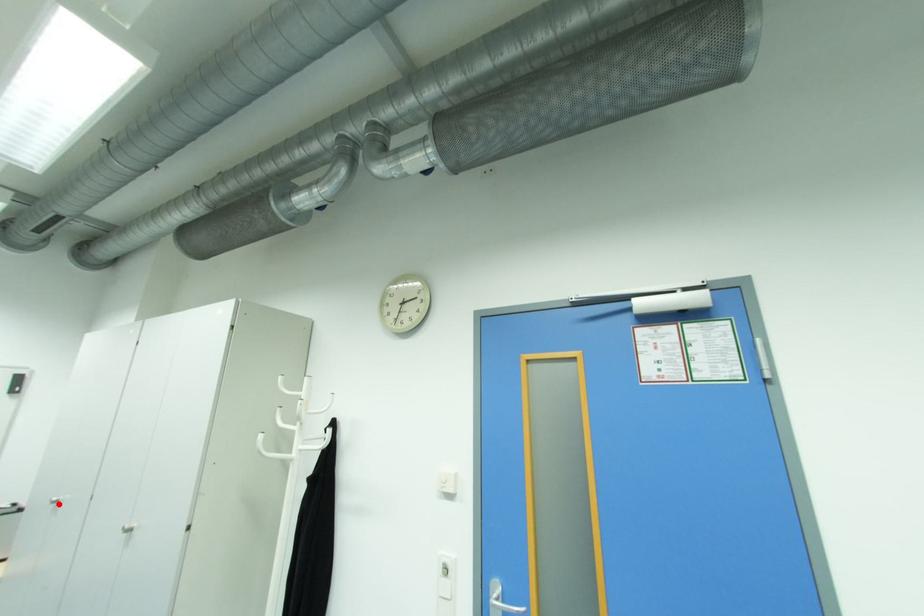
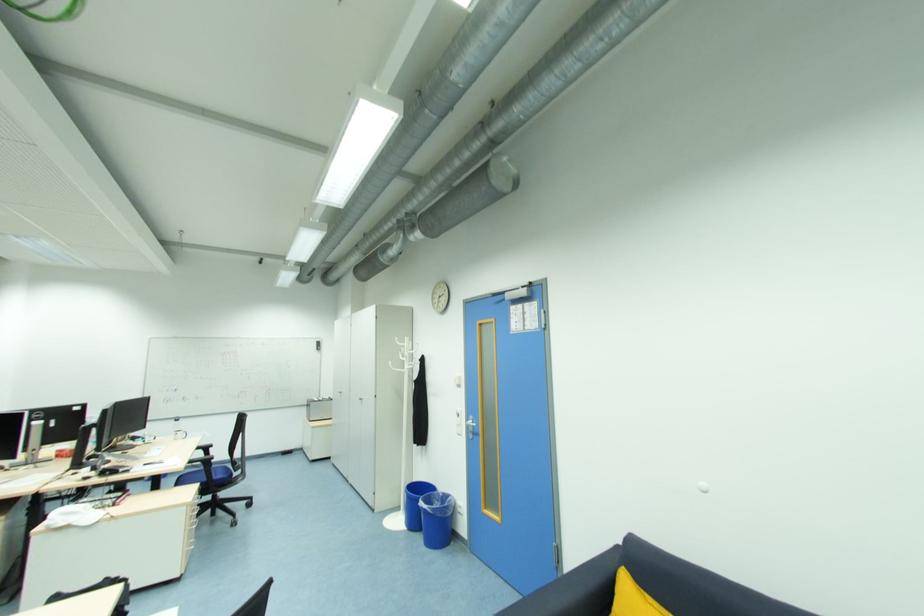
Question: I am providing you with two images of the same scene from different viewpoints. Given a red point in image1, look at the same physical point in image2. Is it:

Choices:
 (A) Closer to the viewpoint
 (B) Farther from the viewpoint

Answer: (B)